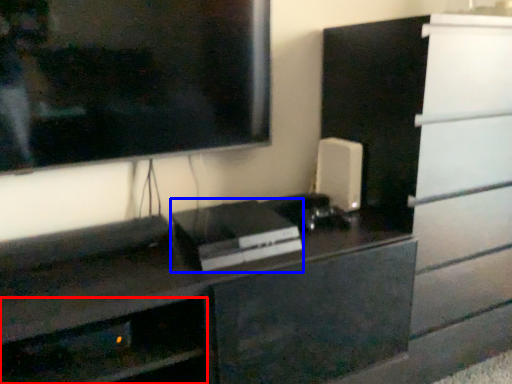
Question: Among these objects, which one is farthest to the camera, shelf (highlighted by a red box) or appliance (highlighted by a blue box)?

Choices:
 (A) shelf
 (B) appliance

Answer: (B)